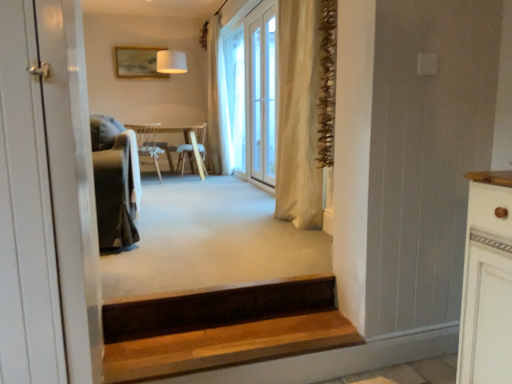
Where is `blank space above wooden stairs at lower center (from a real-world perspective)`? blank space above wooden stairs at lower center (from a real-world perspective) is located at coordinates (241, 337).